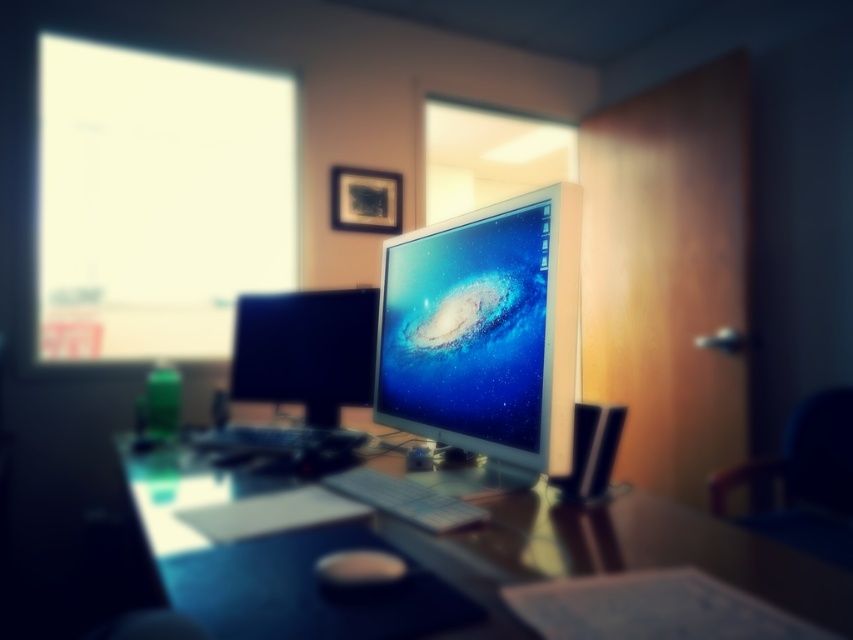
Question: Which object is closer to the camera taking this photo?

Choices:
 (A) white plastic keyboard at center
 (B) matte black mouse at center
 (C) satin silver monitor at center
 (D) smooth wooden desk at center

Answer: (D)

Question: Can you confirm if smooth wooden desk at center is positioned to the left of black glossy monitor at center?

Choices:
 (A) no
 (B) yes

Answer: (A)

Question: Does smooth wooden desk at center appear on the right side of matte black mouse at center?

Choices:
 (A) yes
 (B) no

Answer: (B)

Question: From the image, what is the correct spatial relationship of satin silver monitor at center in relation to white plastic keyboard at center?

Choices:
 (A) right
 (B) left

Answer: (A)

Question: Estimate the real-world distances between objects in this image. Which object is farther from the satin silver monitor at center?

Choices:
 (A) white plastic keyboard at center
 (B) smooth wooden desk at center

Answer: (B)

Question: Which object appears closest to the camera in this image?

Choices:
 (A) smooth wooden desk at center
 (B) satin silver monitor at center
 (C) matte black mouse at center
 (D) black glossy monitor at center

Answer: (A)